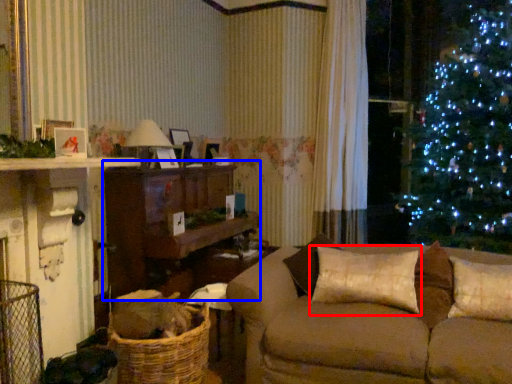
Question: Which point is closer to the camera, pillow (highlighted by a red box) or entertainment center (highlighted by a blue box)?

Choices:
 (A) pillow
 (B) entertainment center

Answer: (A)